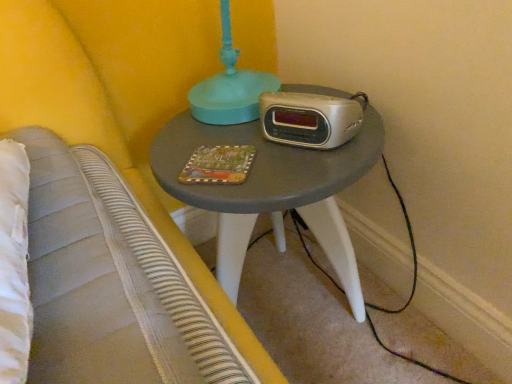
Find the location of `vacant space in front of matte painted wood book at center`. vacant space in front of matte painted wood book at center is located at coordinates point(231,188).